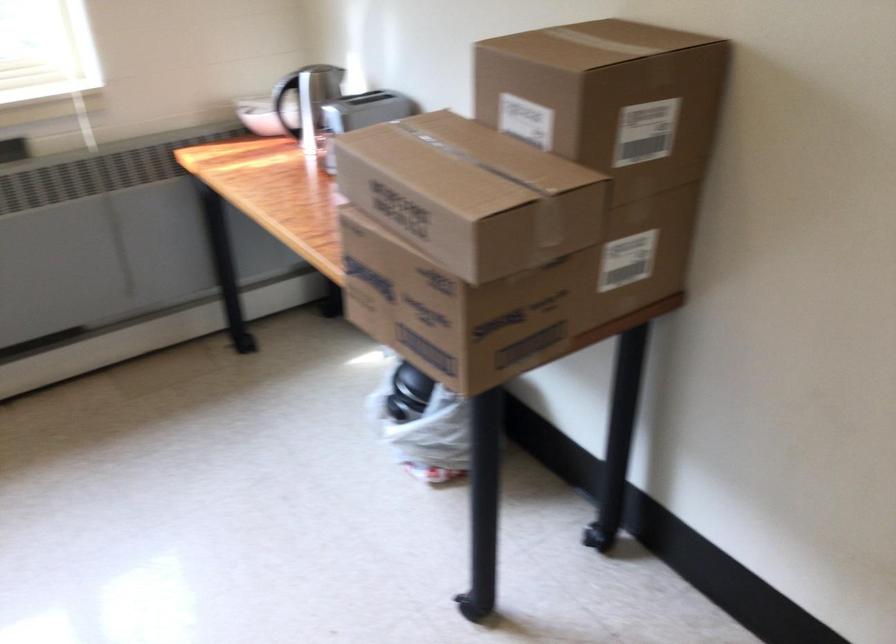
Where would you lift the silver kettle handle? Please return your answer as a coordinate pair (x, y).

(285, 100)